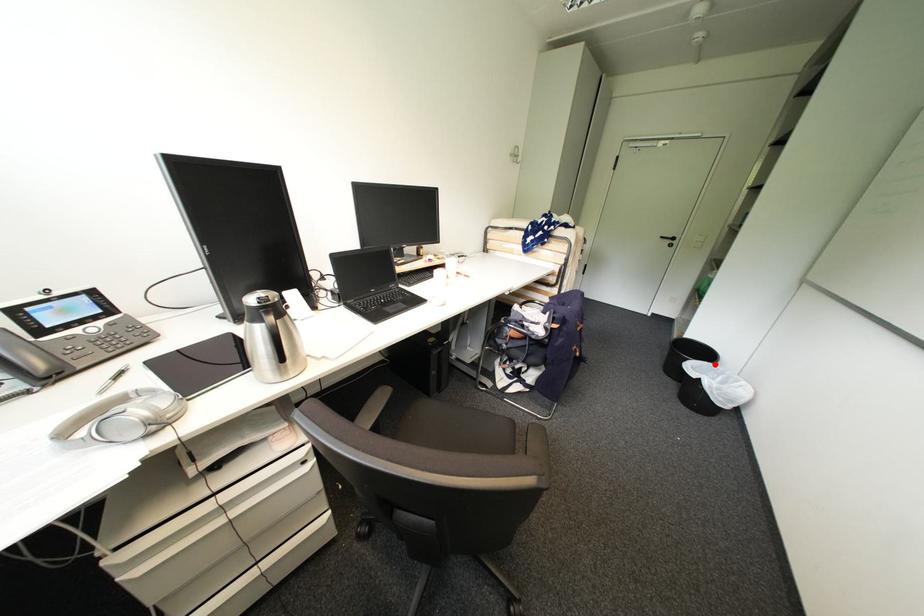
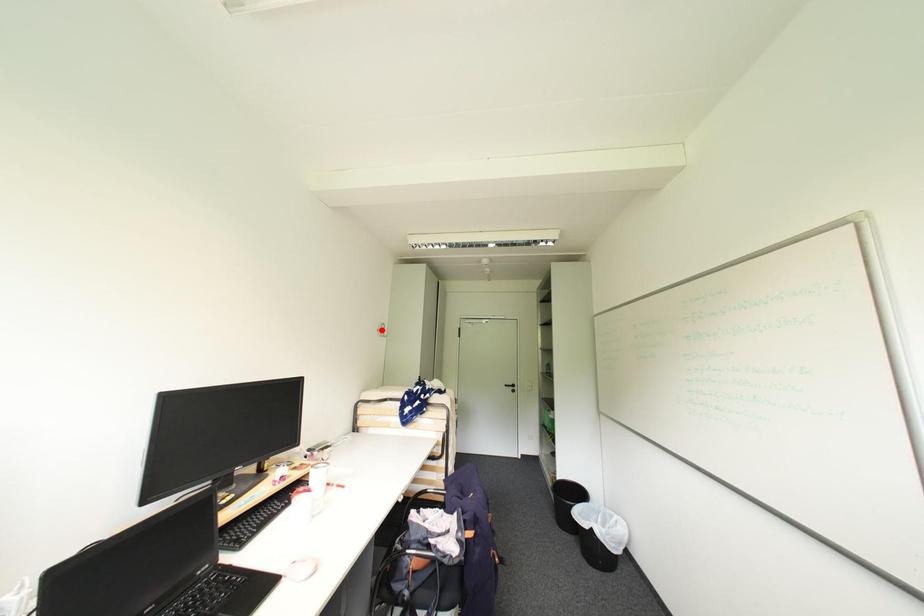
I am providing you with two images of the same scene from different viewpoints. A red point is marked on the first image and another point is marked on the second image. Is the red point in image1 aligned with the point shown in image2?

No